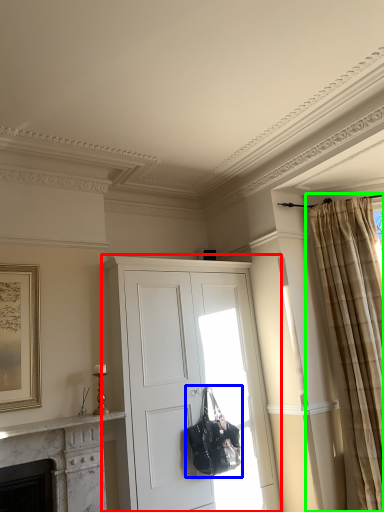
Question: Estimate the real-world distances between objects in this image. Which object is closer to cabinetry (highlighted by a red box), handbag (highlighted by a blue box) or curtain (highlighted by a green box)?

Choices:
 (A) handbag
 (B) curtain

Answer: (A)